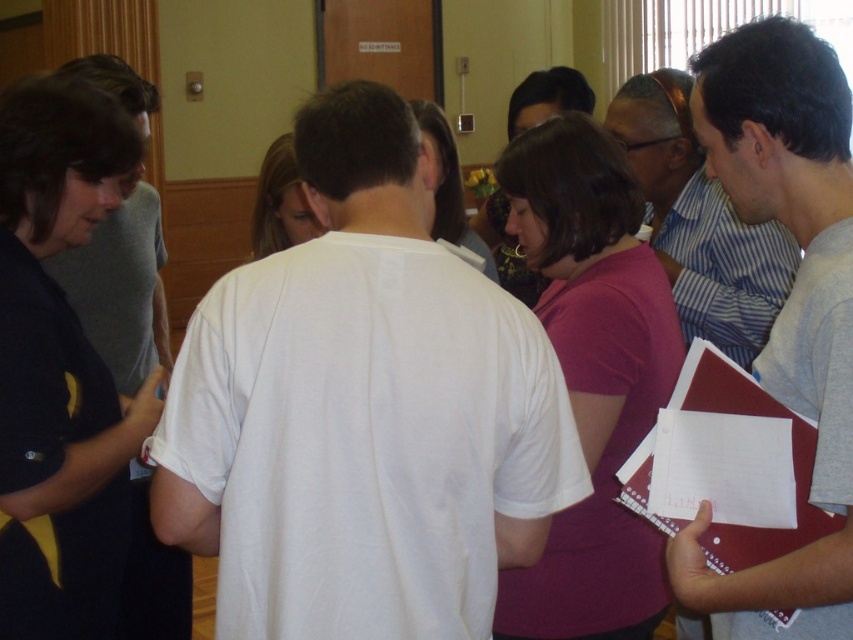
Question: Which object appears farthest from the camera in this image?

Choices:
 (A) gray striped shirt at center
 (B) gray matte folder at center-right

Answer: (A)

Question: Among these objects, which one is nearest to the camera?

Choices:
 (A) gray matte folder at center-right
 (B) gray striped shirt at center

Answer: (A)

Question: Does black matte shirt at left have a lesser width compared to gray matte folder at center-right?

Choices:
 (A) yes
 (B) no

Answer: (A)

Question: Can you confirm if purple matte shirt at center is smaller than gray striped shirt at center?

Choices:
 (A) no
 (B) yes

Answer: (B)

Question: Is gray matte folder at center-right bigger than gray striped shirt at center?

Choices:
 (A) yes
 (B) no

Answer: (B)

Question: Which point is closer to the camera?

Choices:
 (A) gray matte folder at center-right
 (B) black matte shirt at left
 (C) gray striped shirt at center
 (D) purple matte shirt at center

Answer: (A)